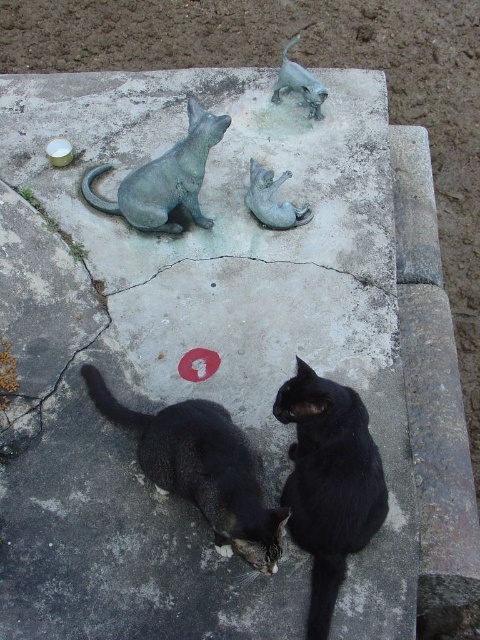
Question: Which point is farther from the camera taking this photo?

Choices:
 (A) (250, 486)
 (B) (255, 179)

Answer: (B)

Question: Is black matte cat at lower right smaller than bronze cat at center?

Choices:
 (A) no
 (B) yes

Answer: (A)

Question: Is black matte cat at lower right further to the viewer compared to shiny black cat at lower center?

Choices:
 (A) yes
 (B) no

Answer: (A)

Question: Considering the real-world distances, which object is closest to the bronze cat at upper center?

Choices:
 (A) black matte cat at lower right
 (B) shiny black cat at lower center

Answer: (B)

Question: Considering the relative positions of black matte cat at lower right and bronze cat at upper center in the image provided, where is black matte cat at lower right located with respect to bronze cat at upper center?

Choices:
 (A) above
 (B) below

Answer: (B)

Question: Which point is farther to the camera?

Choices:
 (A) (368, 528)
 (B) (277, 97)
 (C) (265, 179)

Answer: (B)